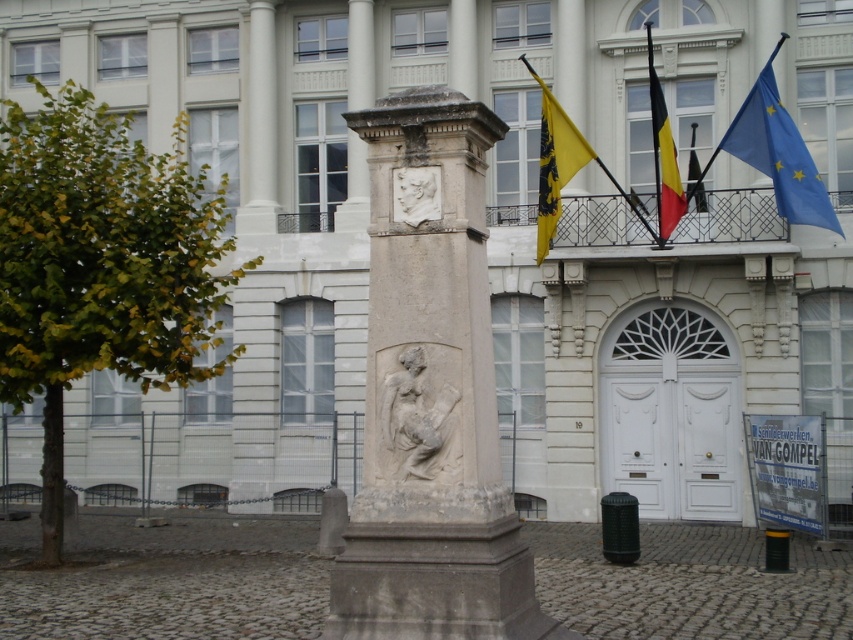
Question: Does gray stone column at center appear over beige stone relief at center?

Choices:
 (A) no
 (B) yes

Answer: (B)

Question: Which point is closer to the camera taking this photo?

Choices:
 (A) (798, 168)
 (B) (670, 134)
 (C) (421, 211)

Answer: (C)

Question: Is beige stone relief at center smaller than red flag at upper center?

Choices:
 (A) no
 (B) yes

Answer: (B)

Question: Among these points, which one is nearest to the camera?

Choices:
 (A) (543, 92)
 (B) (485, 600)
 (C) (439, 189)

Answer: (B)

Question: Which object is positioned closest to the white marble bust at center?

Choices:
 (A) gray stone column at center
 (B) beige stone relief at center
 (C) red flag at upper center
 (D) yellow fabric flag at upper center

Answer: (A)

Question: In this image, where is beige stone relief at center located relative to white marble bust at center?

Choices:
 (A) right
 (B) left

Answer: (B)